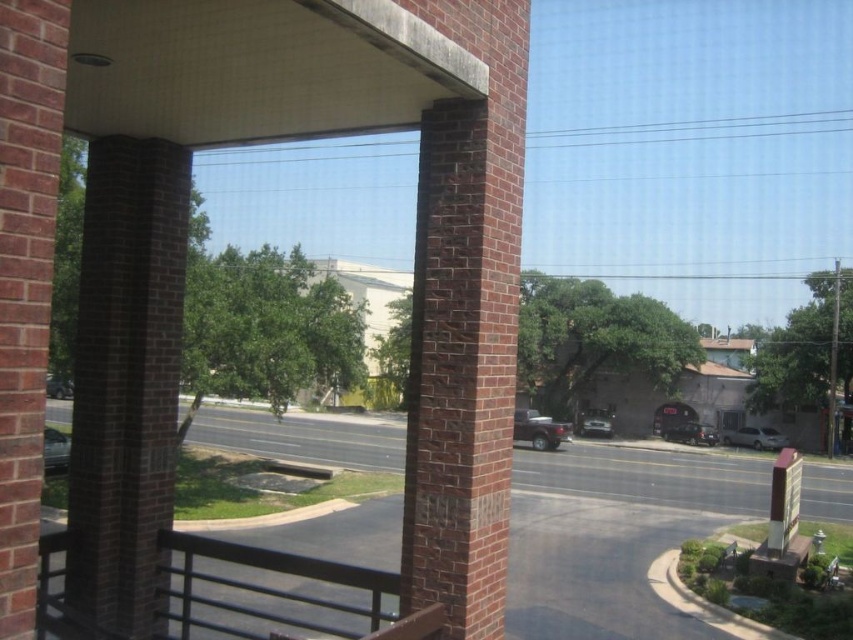
You are standing inside the building and looking out through the window. You notice the matte black car at lower left and the clear glass window at center. Which object is positioned higher from the ground?

The matte black car at lower left is positioned higher from the ground than the clear glass window at center because it is above it.

You are standing inside the building looking out through the large window. You see a point marked at coordinates point (57, 387). What object is located at that point?

The point (57, 387) marks the location of the matte black car at lower left.

You are a delivery person who needs to load a tall package into either the matte black truck at center or the metallic silver car at center. Which vehicle should you choose based on their heights?

The matte black truck at center has a greater height compared to the metallic silver car at center, so you should choose the matte black truck at center to load the tall package.